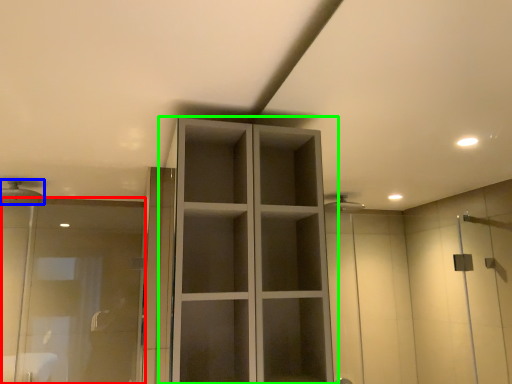
Question: Which is farther away from screen door (highlighted by a red box)? shower (highlighted by a blue box) or cupboard (highlighted by a green box)?

Choices:
 (A) shower
 (B) cupboard

Answer: (B)